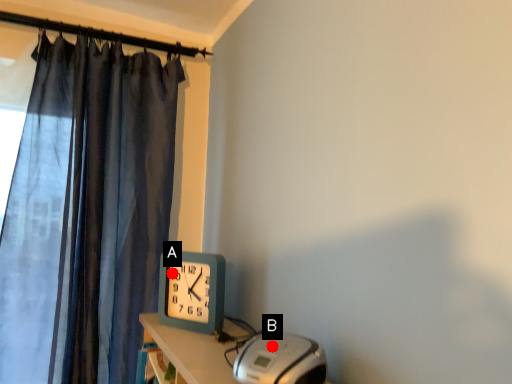
Question: Two points are circled on the image, labeled by A and B beside each circle. Which point is further to the camera?

Choices:
 (A) A is further
 (B) B is further

Answer: (A)